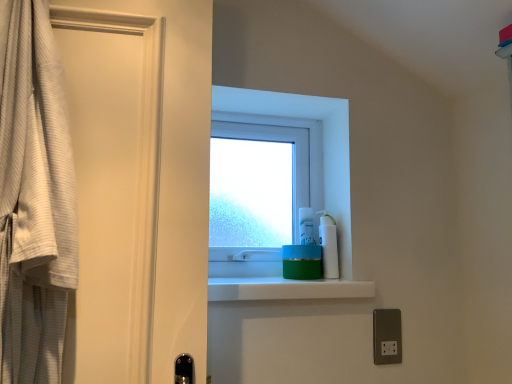
Find the location of `vacant area in front of white plastic pump bottle at upper right`. vacant area in front of white plastic pump bottle at upper right is located at coordinates (330, 283).